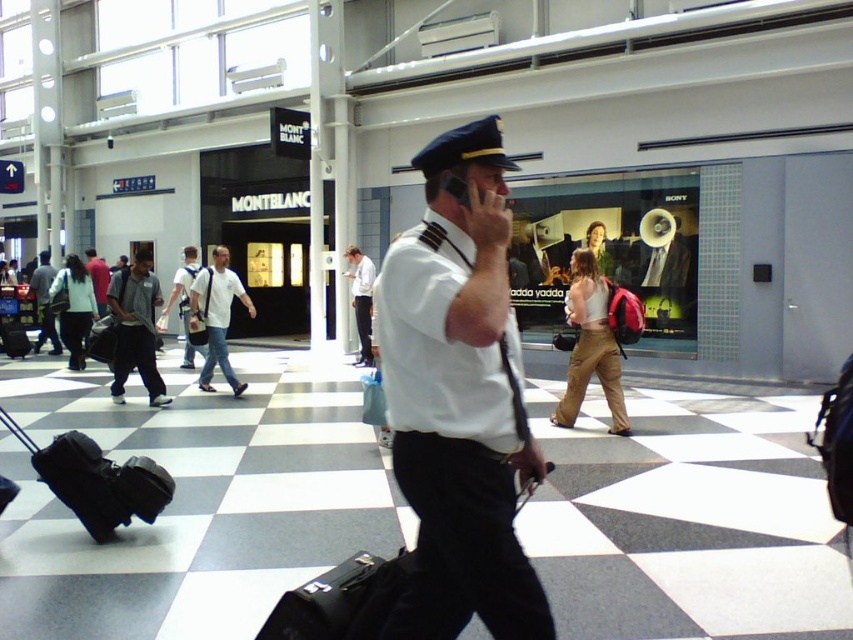
You are standing in the airport terminal and see the white shirt at center. If you want to locate it precisely, what are its coordinates?

The white shirt at center is located at coordinates point (361, 300).

You are a passenger observing a pilot in the airport terminal. You notice the black leather suitcase at center and the white cotton shirt at center. Which object is taller?

The white cotton shirt at center is taller than the black leather suitcase at center.